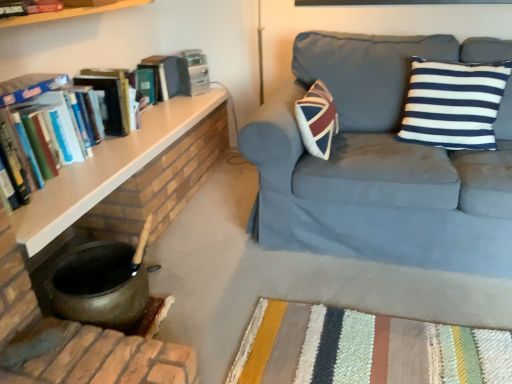
Locate an element on the screen. This screenshot has width=512, height=384. vacant space to the left of suede blue couch at upper right is located at coordinates (219, 246).